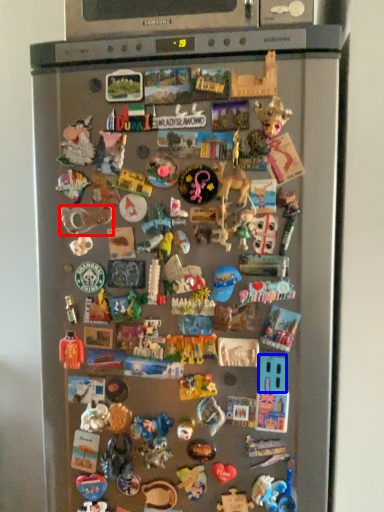
Question: Which point is closer to the camera, toy (highlighted by a red box) or toy (highlighted by a blue box)?

Choices:
 (A) toy
 (B) toy

Answer: (B)